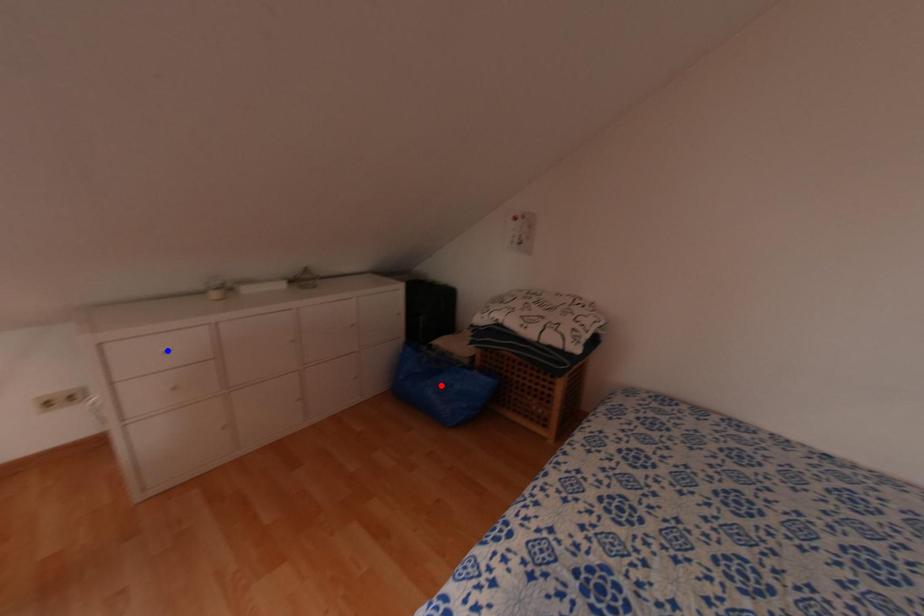
Question: Two points are marked on the image. Which point is closer to the camera?

Choices:
 (A) Blue point is closer.
 (B) Red point is closer.

Answer: (A)